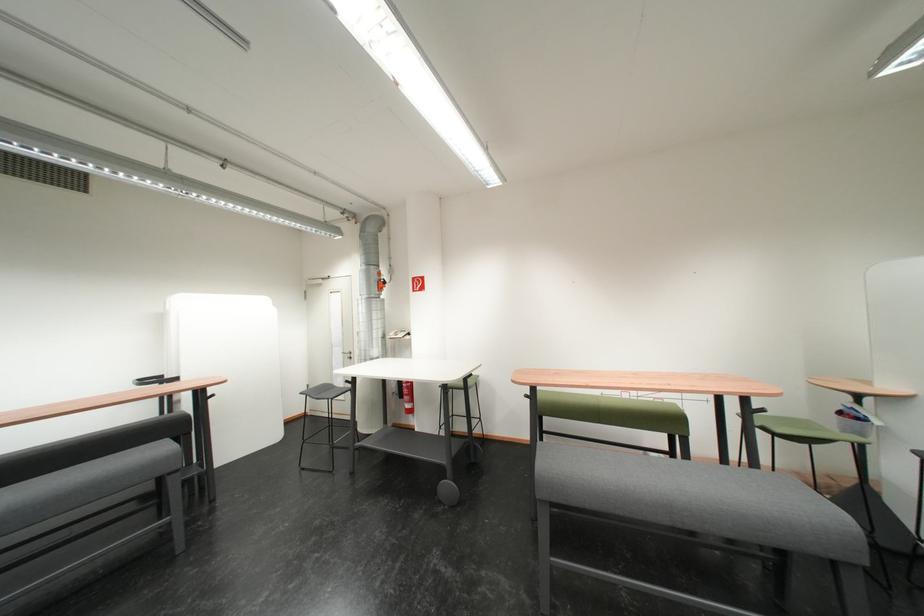
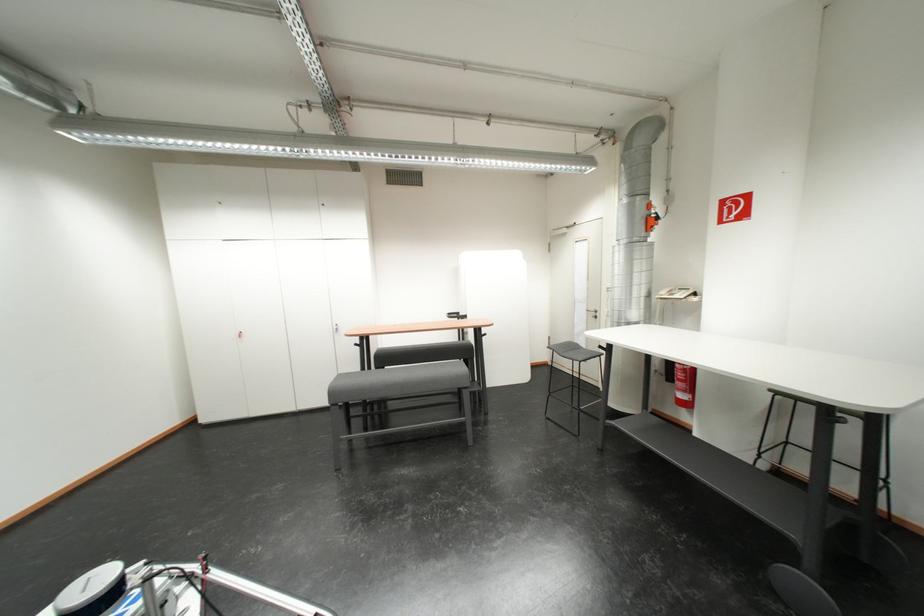
The point at (387, 286) is marked in the first image. Where is the corresponding point in the second image?

(654, 224)